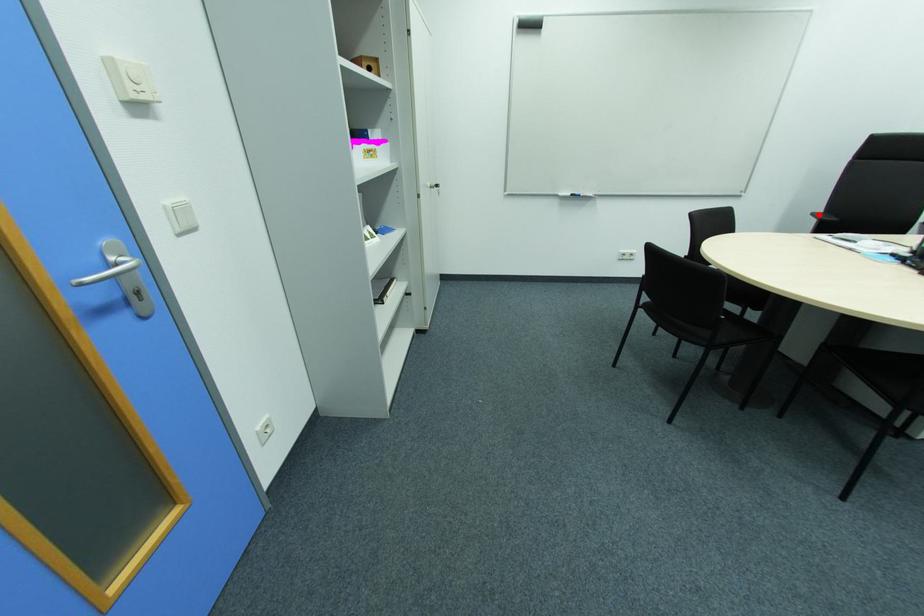
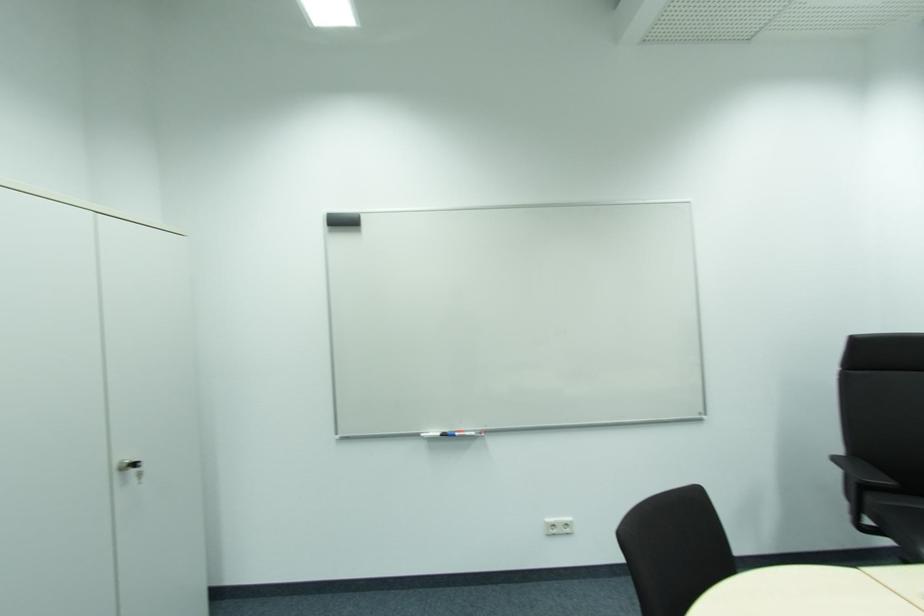
Question: A red point is marked in image1. In image2, is the corresponding 3D point closer to the camera or farther? Reply with the corresponding letter.

Choices:
 (A) The corresponding 3D point is closer.
 (B) The corresponding 3D point is farther.

Answer: (A)